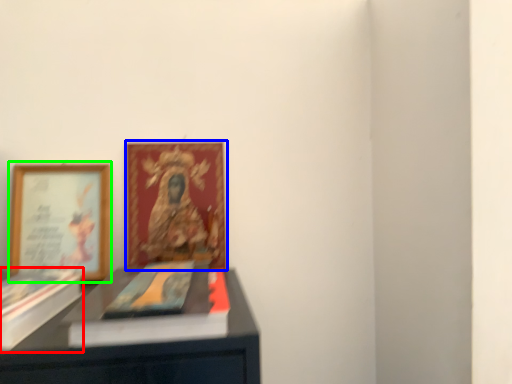
Question: Which is nearer to the paperback book (highlighted by a red box)? picture frame (highlighted by a blue box) or picture frame (highlighted by a green box).

Choices:
 (A) picture frame
 (B) picture frame

Answer: (B)